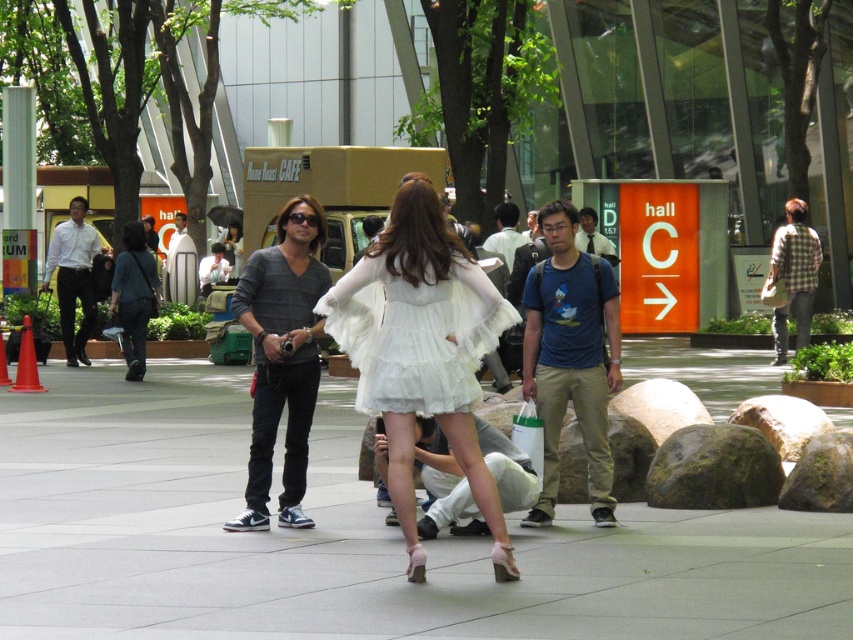
Question: Among these objects, which one is nearest to the camera?

Choices:
 (A) matte gray shirt at center
 (B) plaid shirt at right

Answer: (A)

Question: Does white fluffy dress at center have a smaller size compared to matte black jacket at left?

Choices:
 (A) yes
 (B) no

Answer: (A)

Question: Is white fluffy dress at center positioned at the back of gray sweater at center?

Choices:
 (A) no
 (B) yes

Answer: (A)

Question: Which object appears farthest from the camera in this image?

Choices:
 (A) matte blue shirt at center
 (B) white smooth pavement at center

Answer: (A)

Question: Which of the following is the closest to the observer?

Choices:
 (A) blue cotton t-shirt at center
 (B) matte gray sweater at center

Answer: (A)

Question: Is white lace dress at center to the right of blue cotton shirt at center from the viewer's perspective?

Choices:
 (A) yes
 (B) no

Answer: (B)